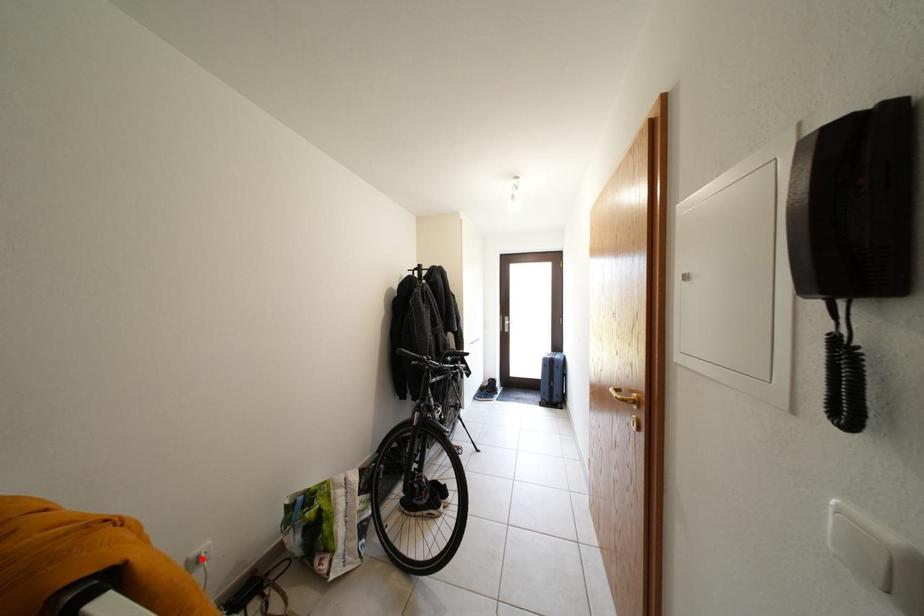
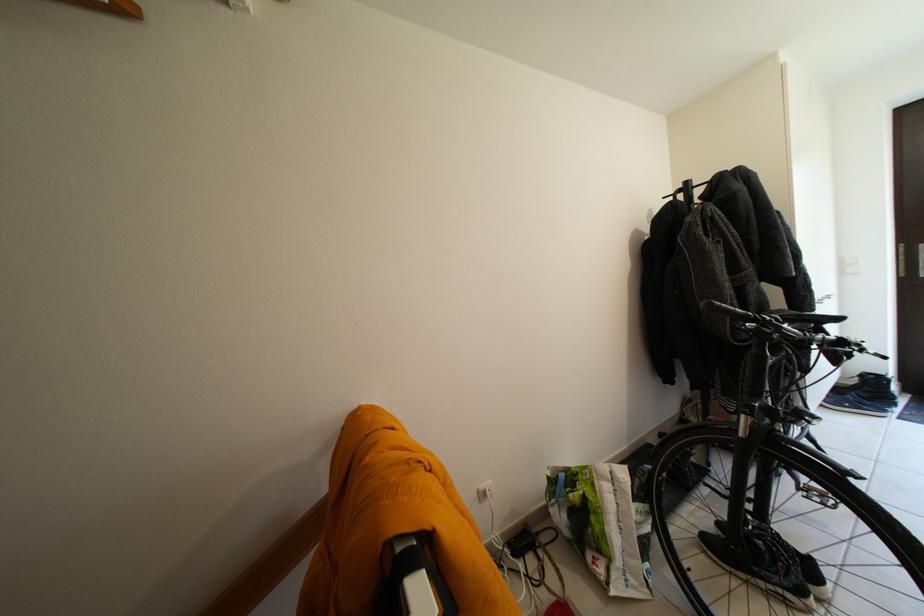
Where in the second image is the point corresponding to the highlighted location from the first image?

(490, 493)